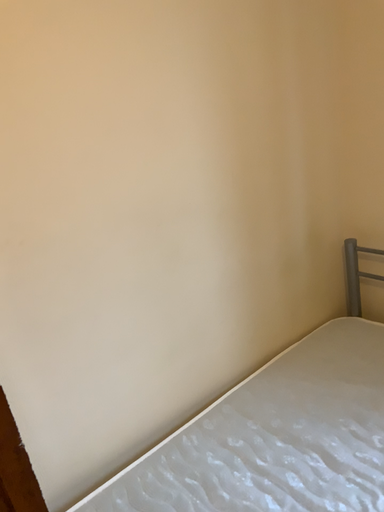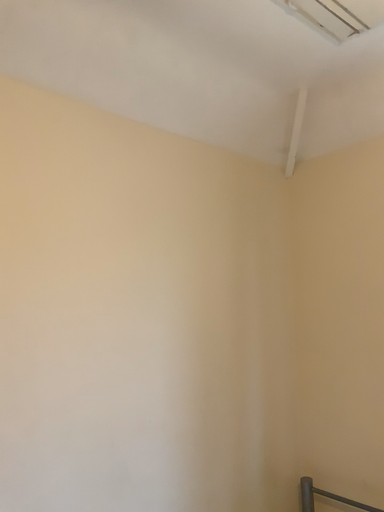
Question: Which way did the camera rotate in the video?

Choices:
 (A) rotated right
 (B) rotated left

Answer: (A)